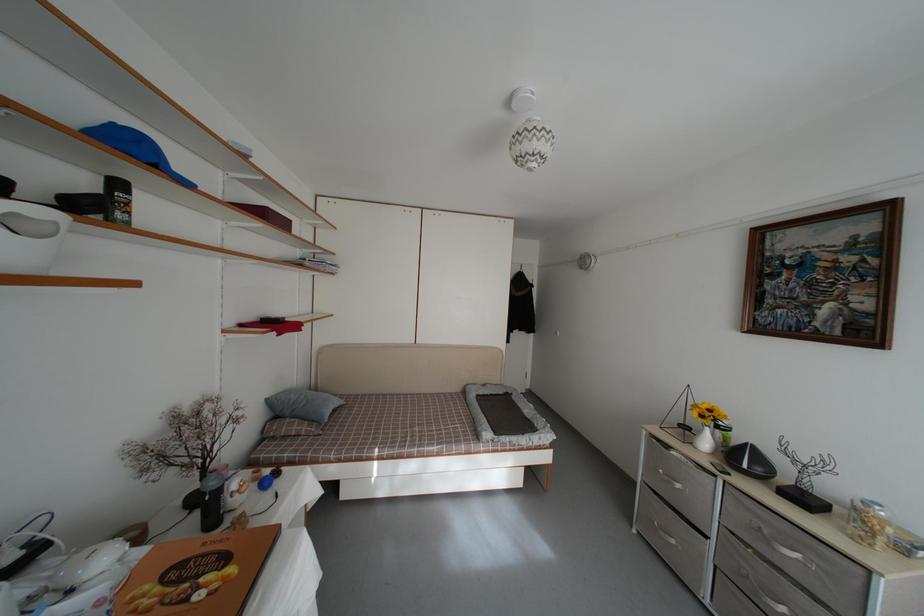
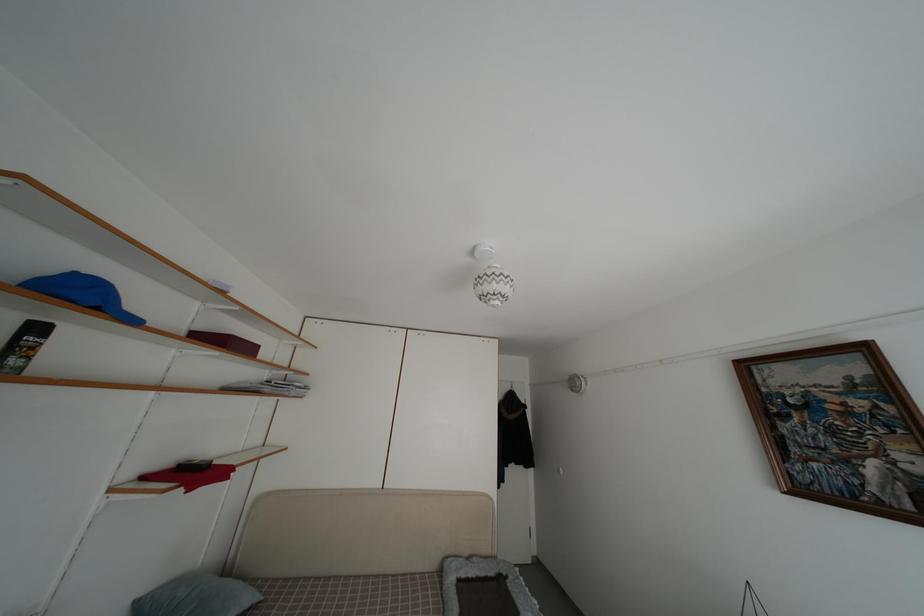
Question: How did the camera likely rotate?

Choices:
 (A) Left
 (B) Right
 (C) Up
 (D) Down

Answer: (C)